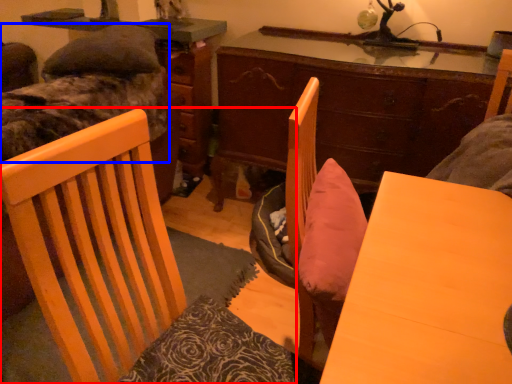
Question: Among these objects, which one is farthest to the camera, chair (highlighted by a red box) or bed (highlighted by a blue box)?

Choices:
 (A) chair
 (B) bed

Answer: (B)